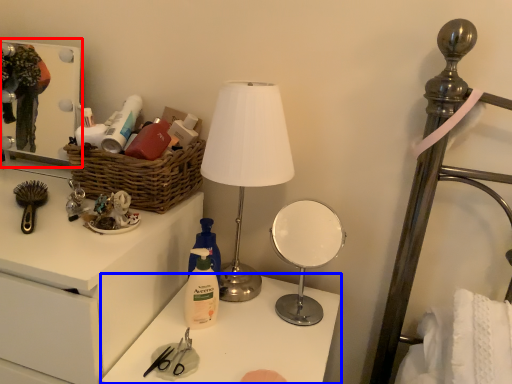
Question: Which object appears closest to the camera in this image, medicine cabinet (highlighted by a red box) or table (highlighted by a blue box)?

Choices:
 (A) medicine cabinet
 (B) table

Answer: (B)